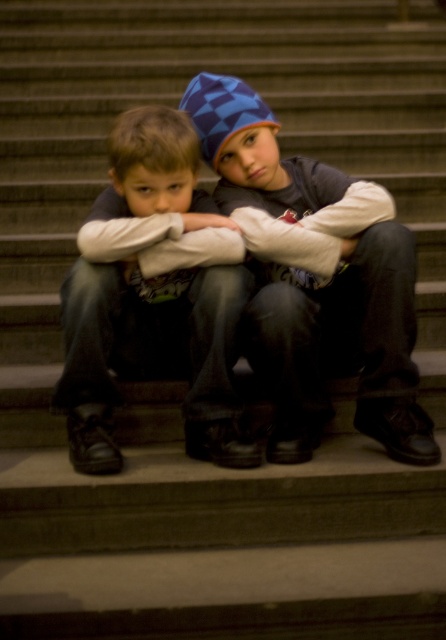
Is blue checkered beanie at center taller than matte black jacket at center?

Yes, blue checkered beanie at center is taller than matte black jacket at center.

The width and height of the screenshot is (446, 640). Find the location of `blue checkered beanie at center`. blue checkered beanie at center is located at coordinates (343, 346).